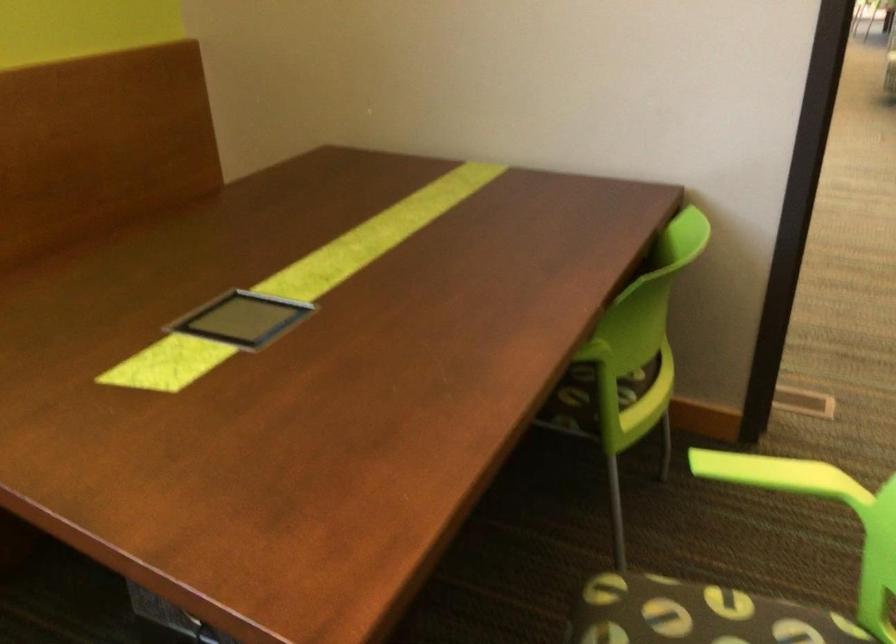
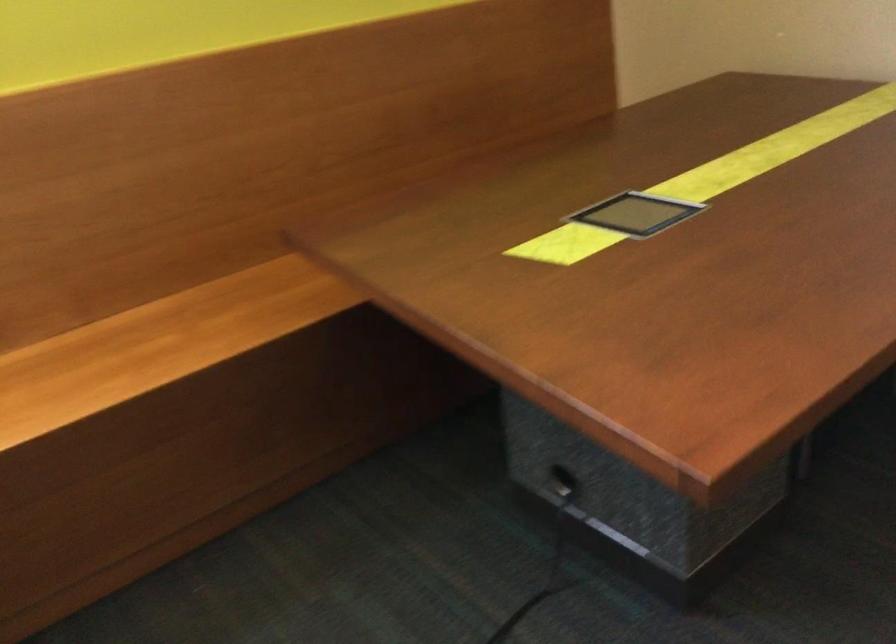
In a continuous first-person perspective shot, in which direction is the camera moving?

The movement direction of the cameraman is right, backward.